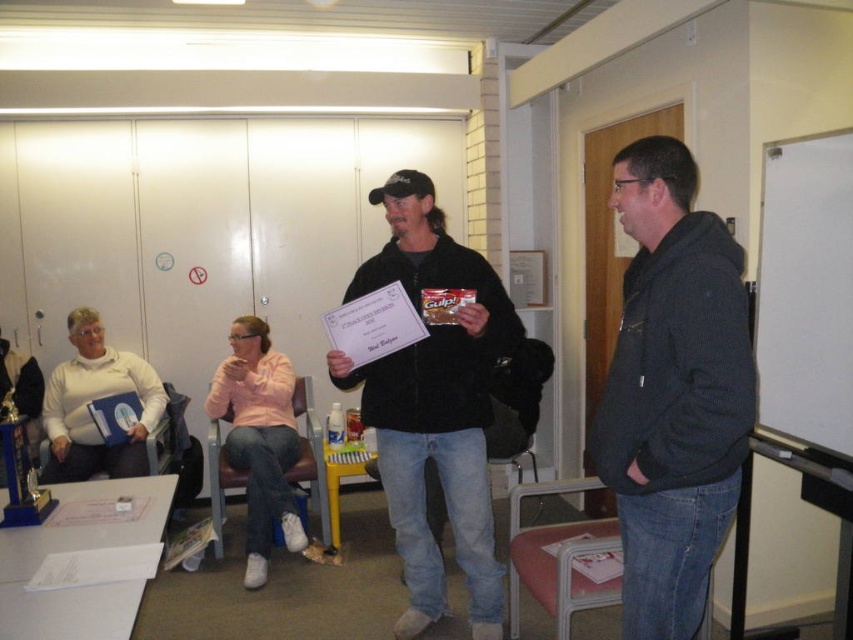
Can you confirm if dark gray hoodie at right is shorter than black matte jacket at center?

Yes.

Where is `dark gray hoodie at right`? The image size is (853, 640). dark gray hoodie at right is located at coordinates (672, 392).

In the scene shown: Measure the distance between point (691, 532) and camera.

Point (691, 532) and camera are 1.72 meters apart from each other.

The height and width of the screenshot is (640, 853). Find the location of `dark gray hoodie at right`. dark gray hoodie at right is located at coordinates (672, 392).

Describe the element at coordinates (434, 404) in the screenshot. I see `black matte jacket at center` at that location.

Is black matte jacket at center smaller than white matte board at right?

No.

Is point (386, 492) closer to camera compared to point (759, 256)?

No, it is not.

The height and width of the screenshot is (640, 853). In order to click on black matte jacket at center in this screenshot , I will do `click(434, 404)`.

Is point (641, 221) in front of point (814, 420)?

Yes, point (641, 221) is in front of point (814, 420).

Is dark gray hoodie at right taller than white matte board at right?

Yes.

What are the coordinates of `dark gray hoodie at right` in the screenshot? It's located at (672, 392).

In order to click on dark gray hoodie at right in this screenshot , I will do `click(672, 392)`.